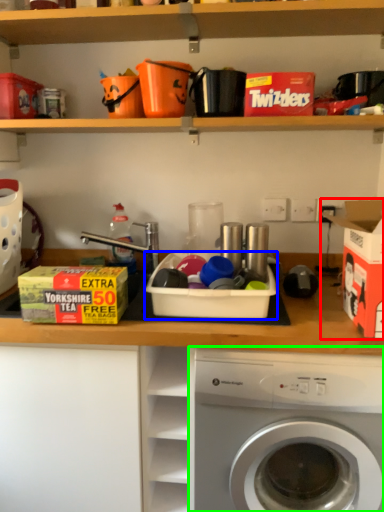
Question: Which object is the farthest from storage box (highlighted by a red box)? Choose among these: storage box (highlighted by a blue box) or washing machine (highlighted by a green box).

Choices:
 (A) storage box
 (B) washing machine

Answer: (B)